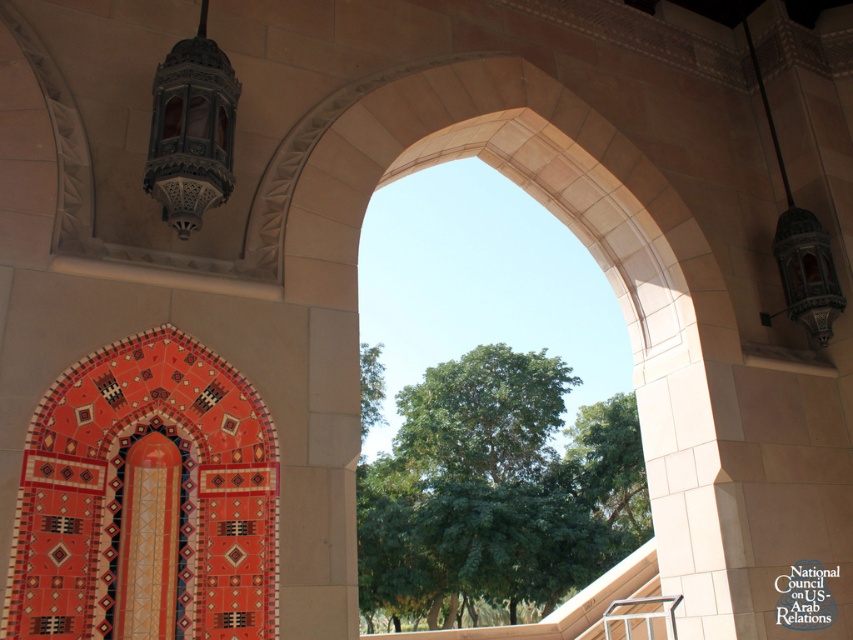
You are an architect designing a new lighting system for the space shown. You need to place a new sensor exactly halfway between the matte metal lantern at upper left and the center of the arch. What are the coordinates of the point where you should place the sensor?

The coordinates of the point halfway between the matte metal lantern at upper left at point (190, 131) and the center of the arch would be the average of their coordinates. Since the center of the arch is at point (426, 320), the midpoint is calculated as follows. The x coordinate is 0.205 plus 0.5 divided by 2, which equals 0.3525. The y coordinate is 0.225 plus 0.5 divided by 2, which equals 0.3625. Therefore, the sensor should be placed at coordinates approximately (306, 224).

You are an interior designer assessing the symmetry of the arched opening. The scene has a matte metal lantern at upper left and a matte orange tile at center. Which object is bigger in size?

The matte metal lantern at upper left is larger in size than the matte orange tile at center.

You are an architect analyzing the symmetry of this space. You notice the matte metal lantern at upper left and the matte orange tile at center. Which object is positioned to the right of the other?

The matte metal lantern at upper left is to the right of the matte orange tile at center.